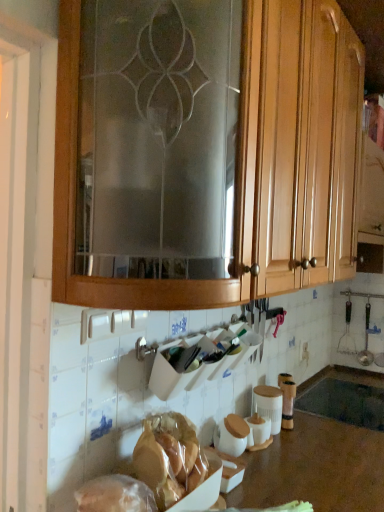
Question: In terms of width, does translucent plastic bag of bread at lower center, which ranks as the second food in back-to-front order, look wider or thinner when compared to translucent plastic bag at lower left, which is the first food in back-to-front order?

Choices:
 (A) wide
 (B) thin

Answer: (A)

Question: Considering the positions of translucent plastic bag of bread at lower center, the first food viewed from the front, and translucent plastic bag at lower left, which is counted as the 2th food, starting from the front, in the image, is translucent plastic bag of bread at lower center, the first food viewed from the front, bigger or smaller than translucent plastic bag at lower left, which is counted as the 2th food, starting from the front,?

Choices:
 (A) big
 (B) small

Answer: (A)

Question: Which object is the farthest from the translucent plastic bag at lower left, which is counted as the 2th food, starting from the front?

Choices:
 (A) translucent plastic bag of bread at lower center, which ranks as the second food in back-to-front order
 (B) black matte sink at lower center
 (C) matte brown jar at lower center
 (D) wooden cabinet at upper center
 (E) brown polished wood at lower center

Answer: (B)

Question: Which is farther from the black matte sink at lower center?

Choices:
 (A) wooden cabinet at upper center
 (B) translucent plastic bag at lower left, which is counted as the 2th food, starting from the front
 (C) translucent plastic bag of bread at lower center, the first food viewed from the front
 (D) matte brown jar at lower center
 (E) brown polished wood at lower center

Answer: (B)